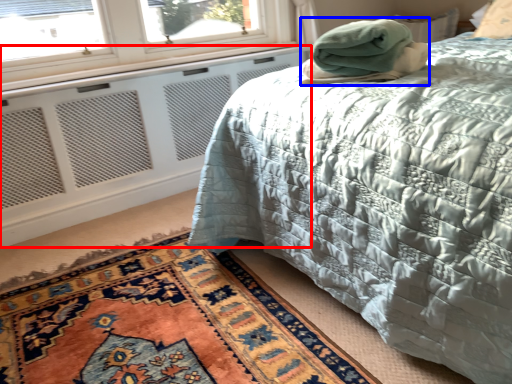
Question: Which object is further to the camera taking this photo, radiator (highlighted by a red box) or blanket (highlighted by a blue box)?

Choices:
 (A) radiator
 (B) blanket

Answer: (A)